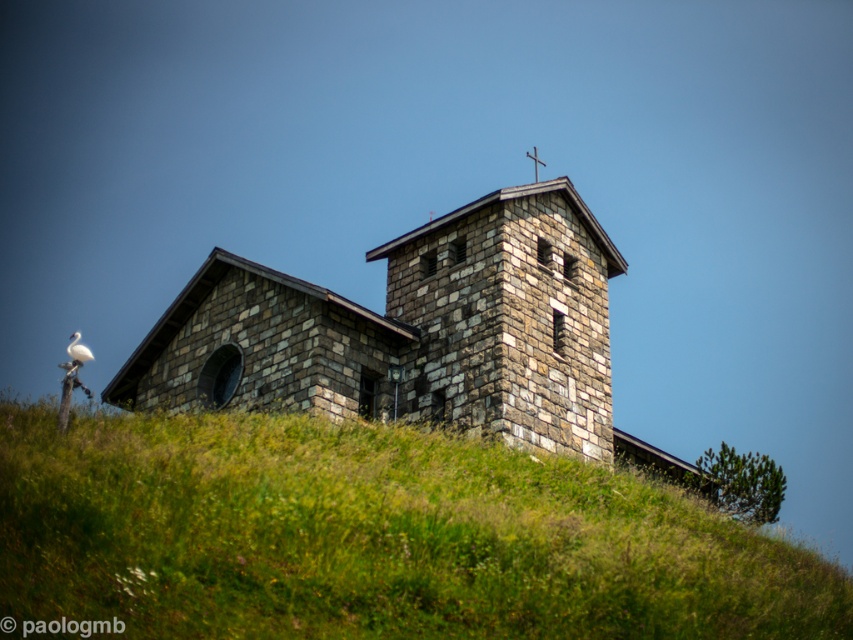
Question: Considering the real-world distances, which object is closest to the green grassy hillside at center?

Choices:
 (A) stone church at center
 (B) white feathered bird at upper left

Answer: (A)

Question: Can you confirm if green grassy hillside at center is positioned to the left of stone church at center?

Choices:
 (A) no
 (B) yes

Answer: (B)

Question: Is green grassy hillside at center to the left of stone church at center from the viewer's perspective?

Choices:
 (A) yes
 (B) no

Answer: (A)

Question: Estimate the real-world distances between objects in this image. Which object is farther from the stone church at center?

Choices:
 (A) white feathered bird at upper left
 (B) green grassy hillside at center

Answer: (A)

Question: Is green grassy hillside at center above white feathered bird at upper left?

Choices:
 (A) yes
 (B) no

Answer: (B)

Question: Which of the following is the farthest from the observer?

Choices:
 (A) green grassy hillside at center
 (B) white feathered bird at upper left

Answer: (B)